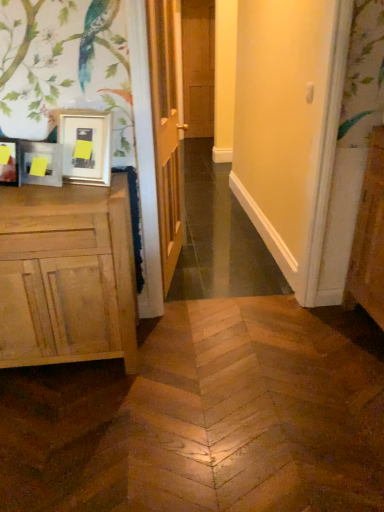
Question: Considering the positions of point (61, 165) and point (150, 55), is point (61, 165) closer or farther from the camera than point (150, 55)?

Choices:
 (A) closer
 (B) farther

Answer: (A)

Question: Relative to wooden door at center, marked as the second door in a back-to-front arrangement, is matte wooden picture frame at left in front or behind?

Choices:
 (A) behind
 (B) front

Answer: (B)

Question: Estimate the real-world distances between objects in this image. Which object is farther from the natural wood cabinet at left?

Choices:
 (A) matte wood screen door at center
 (B) wooden door at center, acting as the 1th door starting from the front
 (C) brown wooden door at center, acting as the 1th door starting from the back
 (D) matte wooden picture frame at left

Answer: (C)

Question: Which is farther from the matte wood screen door at center?

Choices:
 (A) brown wooden door at center, acting as the 1th door starting from the back
 (B) wooden door at center, positioned as the 1th door in bottom-to-top order
 (C) natural wood cabinet at left
 (D) matte wooden picture frame at left

Answer: (A)